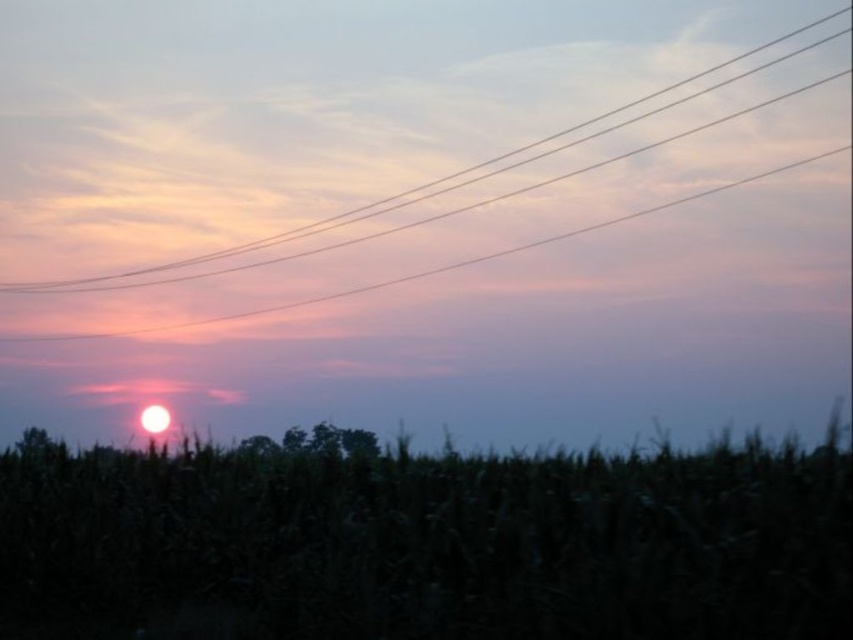
Question: Does green matte corn field at lower center have a smaller size compared to clear wire at upper center?

Choices:
 (A) yes
 (B) no

Answer: (B)

Question: Which point is closer to the camera?

Choices:
 (A) clear wire at upper center
 (B) green matte corn field at lower center

Answer: (B)

Question: Is green matte corn field at lower center above clear wire at upper center?

Choices:
 (A) no
 (B) yes

Answer: (A)

Question: Can you confirm if green matte corn field at lower center is positioned above clear wire at upper center?

Choices:
 (A) no
 (B) yes

Answer: (A)

Question: Among these objects, which one is farthest from the camera?

Choices:
 (A) green matte corn field at lower center
 (B) clear wire at upper center

Answer: (B)